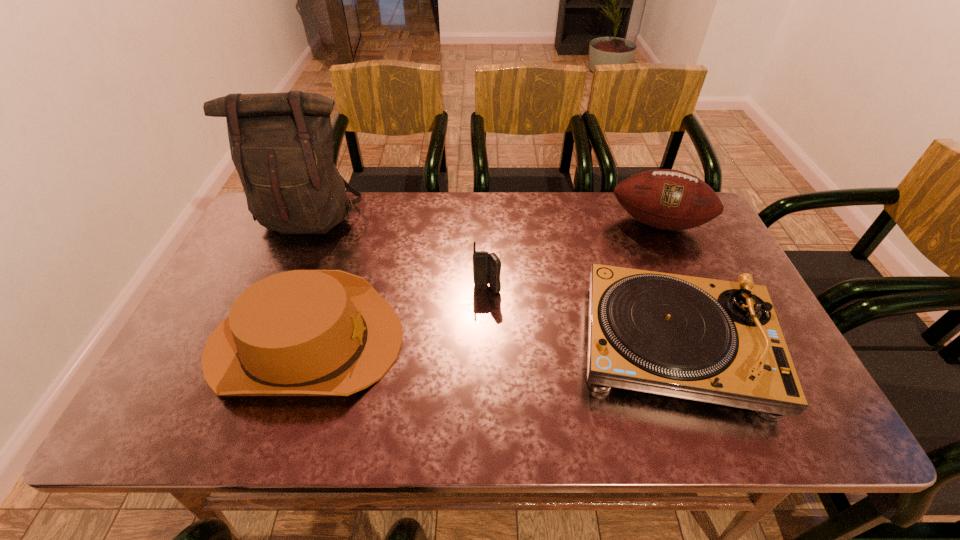
Identify the location of backpack that is at the far edge. The height and width of the screenshot is (540, 960). (281, 144).

This screenshot has width=960, height=540. Identify the location of football (American) that is at the far edge. (668, 199).

Where is `cowboy hat located at the near edge`? Image resolution: width=960 pixels, height=540 pixels. cowboy hat located at the near edge is located at coordinates (302, 332).

Find the location of `record player situated at the near edge`. record player situated at the near edge is located at coordinates 714,341.

Locate an element on the screen. The width and height of the screenshot is (960, 540). backpack located at the left edge is located at coordinates (281, 144).

I want to click on cowboy hat that is at the left edge, so click(302, 332).

Find the location of `football (American) at the right edge`. football (American) at the right edge is located at coordinates (668, 199).

What are the coordinates of `record player that is at the right edge` in the screenshot? It's located at (714, 341).

The height and width of the screenshot is (540, 960). Identify the location of object present at the far left corner. (281, 144).

Where is `object that is at the near left corner`? object that is at the near left corner is located at coordinates point(302,332).